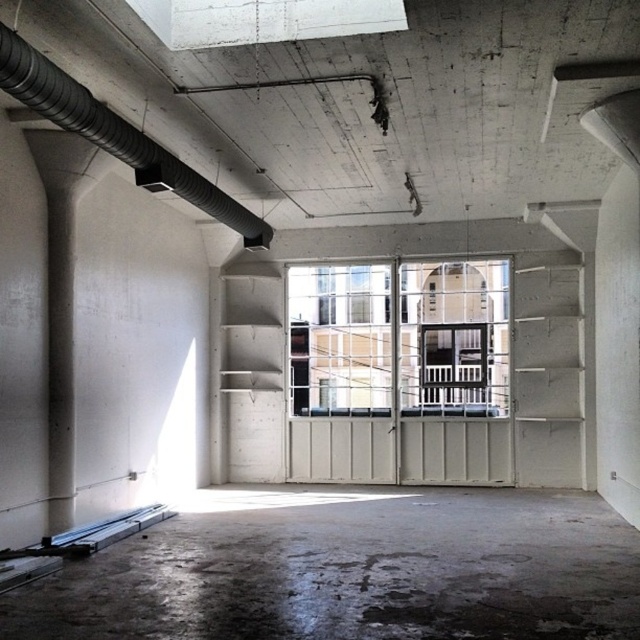
Is clear glass window at center smaller than black rubber pipe at upper left?

No.

Does clear glass window at center lie in front of black rubber pipe at upper left?

No, it is behind black rubber pipe at upper left.

You are a GUI agent. You are given a task and a screenshot of the screen. Output one action in this format:
    pyautogui.click(x=<x>, y=<y>)
    Task: Click on the clear glass window at center
    The image size is (640, 640).
    Given the screenshot: What is the action you would take?
    pyautogui.click(x=400, y=339)

At what (x,y) coordinates should I click in order to perform the action: click on clear glass window at center. Please return your answer as a coordinate pair (x, y). This screenshot has height=640, width=640. Looking at the image, I should click on (400, 339).

Is concrete floor at center thinner than clear glass window at center?

Correct, concrete floor at center's width is less than clear glass window at center's.

Is concrete floor at center wider than clear glass window at center?

In fact, concrete floor at center might be narrower than clear glass window at center.

Between point (451, 637) and point (499, 412), which one is positioned behind?

The point (499, 412) is behind.

You are a GUI agent. You are given a task and a screenshot of the screen. Output one action in this format:
    pyautogui.click(x=<x>, y=<y>)
    Task: Click on the concrete floor at center
    
    Given the screenshot: What is the action you would take?
    pyautogui.click(x=349, y=570)

Between point (584, 538) and point (221, 196), which one is positioned behind?

Positioned behind is point (221, 196).

Where is `concrete floor at center`? The image size is (640, 640). concrete floor at center is located at coordinates (349, 570).